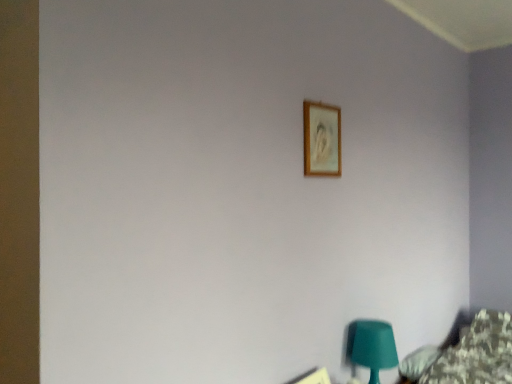
Question: From a real-world perspective, is matte green plastic table lamp at lower right physically located above or below wooden frame at upper center, the second picture frame in the bottom-to-top sequence?

Choices:
 (A) below
 (B) above

Answer: (A)

Question: Considering the relative positions of matte green plastic table lamp at lower right and wooden frame at upper center, the 1th picture frame positioned from the top, in the image provided, is matte green plastic table lamp at lower right to the left or to the right of wooden frame at upper center, the 1th picture frame positioned from the top,?

Choices:
 (A) right
 (B) left

Answer: (A)

Question: Considering the real-world distances, which object is farthest from the matte green plastic table lamp at lower right?

Choices:
 (A) wooden picture frame at upper center, arranged as the 2th picture frame when viewed from the top
 (B) wooden frame at upper center, the 1th picture frame positioned from the top

Answer: (B)

Question: Estimate the real-world distances between objects in this image. Which object is farther from the wooden frame at upper center, the 1th picture frame positioned from the top?

Choices:
 (A) matte green plastic table lamp at lower right
 (B) wooden picture frame at upper center, arranged as the 2th picture frame when viewed from the top

Answer: (B)